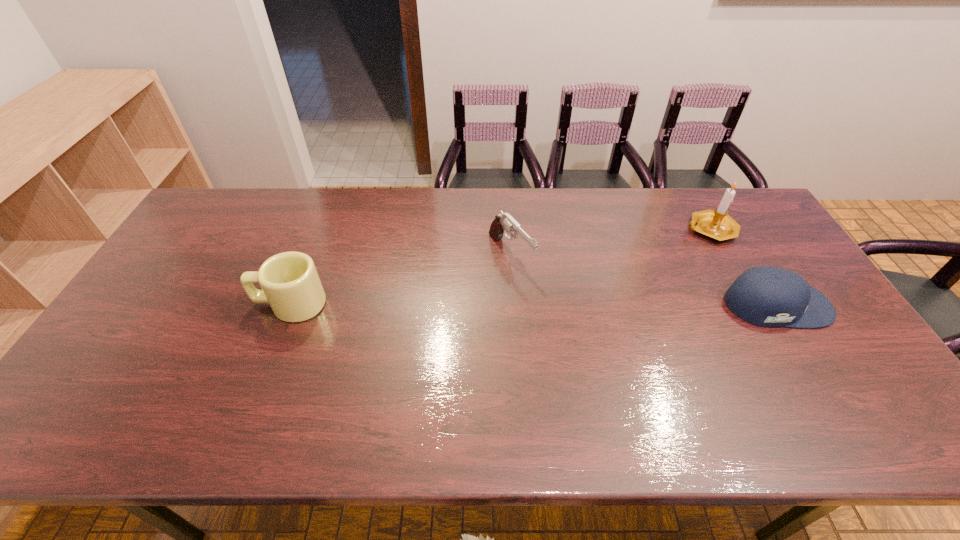
Locate an element on the screen. unoccupied position between the leftmost object and the gun is located at coordinates (400, 279).

The height and width of the screenshot is (540, 960). Identify the location of empty space that is in between the shortest object and the candle holder. (743, 267).

Point out which object is positioned as the nearest to the leftmost object. Please provide its 2D coordinates. Your answer should be formatted as a tuple, i.e. [(x, y)], where the tuple contains the x and y coordinates of a point satisfying the conditions above.

[(504, 222)]

Identify the location of object that is the closest to the tallest object. (767, 296).

Where is `free space that satisfies the following two spatial constraints: 1. on the back side of the candle holder; 2. on the left side of the third object from right to left`? The image size is (960, 540). free space that satisfies the following two spatial constraints: 1. on the back side of the candle holder; 2. on the left side of the third object from right to left is located at coordinates (509, 230).